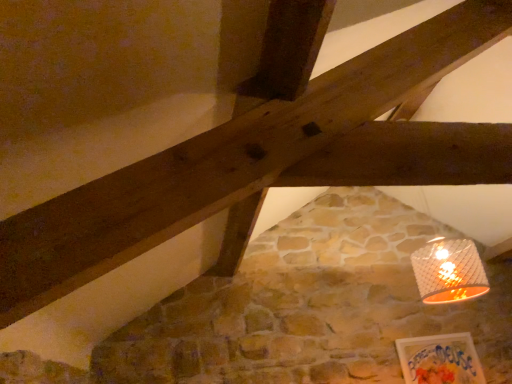
Image resolution: width=512 pixels, height=384 pixels. What do you see at coordinates (440, 360) in the screenshot? I see `matte white picture frame at lower right` at bounding box center [440, 360].

Locate an element on the screen. This screenshot has width=512, height=384. matte white picture frame at lower right is located at coordinates (440, 360).

The width and height of the screenshot is (512, 384). Identify the location of matte white picture frame at lower right. 440,360.